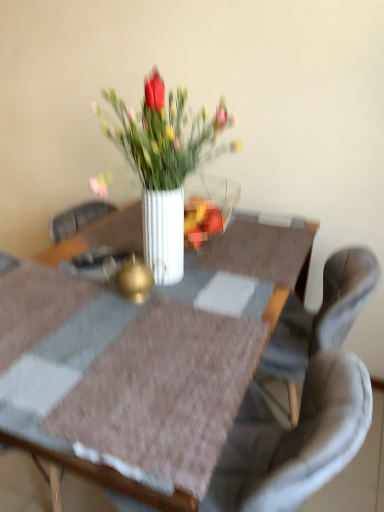
Question: Looking at the image, does white glossy vase at center seem bigger or smaller compared to gray fabric chair at center?

Choices:
 (A) small
 (B) big

Answer: (A)

Question: In terms of height, does white glossy vase at center look taller or shorter compared to gray fabric chair at center?

Choices:
 (A) tall
 (B) short

Answer: (B)

Question: Based on their relative distances, which object is nearer to the white glossy vase at center?

Choices:
 (A) gray fabric chair at center
 (B) white glossy vase at center

Answer: (B)

Question: Estimate the real-world distances between objects in this image. Which object is closer to the gray fabric chair at center?

Choices:
 (A) white glossy vase at center
 (B) white glossy vase at center

Answer: (A)